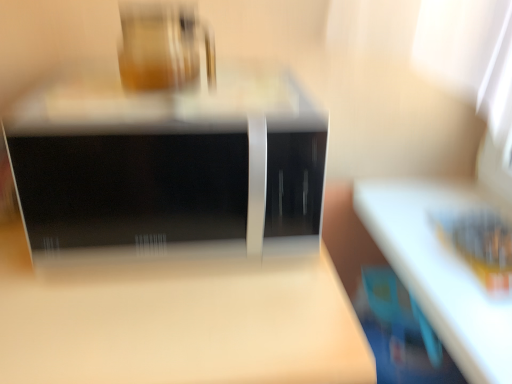
In order to click on free location in front of black glossy microwave at center in this screenshot , I will do `click(175, 325)`.